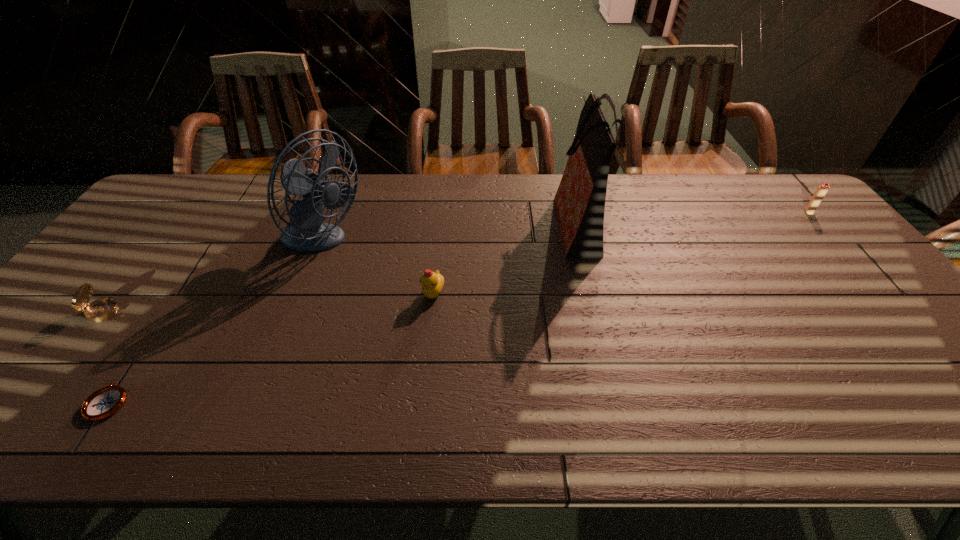
The image size is (960, 540). Find the location of `free space that is in between the igniter and the second object from left to right`. free space that is in between the igniter and the second object from left to right is located at coordinates (458, 307).

Identify the location of vacant space that's between the leftmost object and the fourth object from left to right. (270, 302).

Find the location of a particular element. Image resolution: width=960 pixels, height=540 pixels. vacant space that is in between the farther compass and the shopping bag is located at coordinates (342, 267).

This screenshot has width=960, height=540. Identify the location of empty space that is in between the duckling and the rightmost object. (621, 253).

At what (x,y) coordinates should I click in order to perform the action: click on blank region between the igniter and the leftmost object. Please return your answer as a coordinate pair (x, y). Image resolution: width=960 pixels, height=540 pixels. Looking at the image, I should click on (457, 262).

Where is `vacant area that lies between the shopping bag and the rightmost object`? This screenshot has width=960, height=540. vacant area that lies between the shopping bag and the rightmost object is located at coordinates (693, 217).

Select which object is the closest to the farther compass. Please provide its 2D coordinates. Your answer should be formatted as a tuple, i.e. [(x, y)], where the tuple contains the x and y coordinates of a point satisfying the conditions above.

[(103, 403)]

The height and width of the screenshot is (540, 960). I want to click on the third closest object to the duckling, so click(x=103, y=403).

Where is `free space that satisfies the following two spatial constraints: 1. with the dial facing the left compass; 2. on the left side of the shortest object`? The image size is (960, 540). free space that satisfies the following two spatial constraints: 1. with the dial facing the left compass; 2. on the left side of the shortest object is located at coordinates (36, 402).

Locate an element on the screen. The height and width of the screenshot is (540, 960). free space that satisfies the following two spatial constraints: 1. on the front side of the rightmost object; 2. on the front side of the shopping bag is located at coordinates (817, 222).